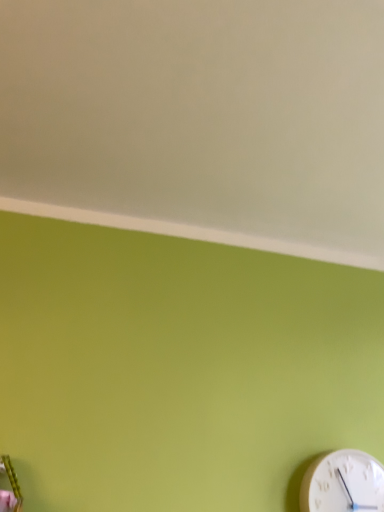
Describe the element at coordinates (343, 483) in the screenshot. I see `white plastic wall clock at lower right` at that location.

At what (x,y) coordinates should I click in order to perform the action: click on white plastic wall clock at lower right. Please return your answer as a coordinate pair (x, y). This screenshot has width=384, height=512. Looking at the image, I should click on (343, 483).

This screenshot has height=512, width=384. In order to click on white plastic wall clock at lower right in this screenshot , I will do `click(343, 483)`.